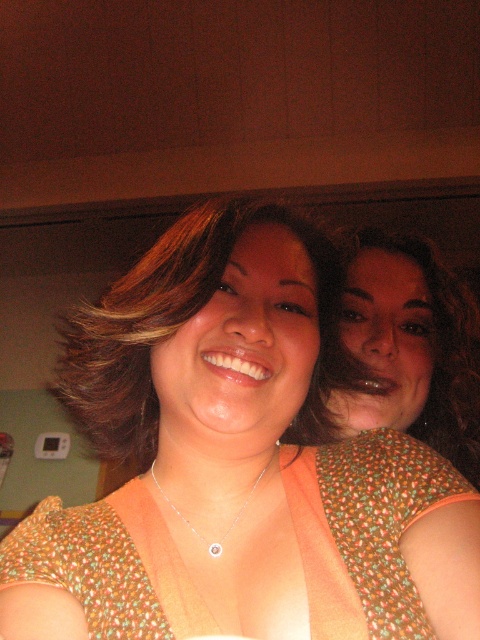
You are standing in front of the image and want to touch the orange printed blouse at center and the matte brown hair at center. Which one can you reach first without moving your hand?

The orange printed blouse at center is closer to the viewer than the matte brown hair at center, so you can reach the orange printed blouse at center first.

You are standing in front of the image and want to locate the orange printed blouse at center. What coordinates should you look at?

The orange printed blouse at center is located at coordinates point (x=239, y=460).

You are a fashion designer analyzing the image. You need to determine which clothing item is visible on top between the orange printed blouse at center and the printed fabric dress at center. Based on the spatial arrangement, which one is on top?

The orange printed blouse at center is positioned over the printed fabric dress at center, so it is visible on top.